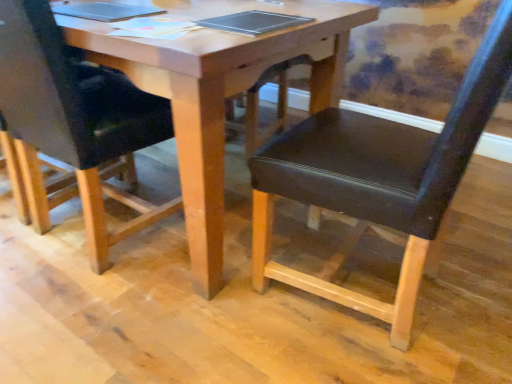
Find the location of `black leather chair at center, marked as the second chair in a left-to-right arrangement`. black leather chair at center, marked as the second chair in a left-to-right arrangement is located at coordinates (378, 180).

The image size is (512, 384). Find the location of `wooden table at center`. wooden table at center is located at coordinates (220, 92).

Describe the element at coordinates (73, 126) in the screenshot. I see `black leather chair at center, acting as the 1th chair starting from the left` at that location.

Find the location of a particular element. black leather chair at center, marked as the second chair in a left-to-right arrangement is located at coordinates (378, 180).

Is point (314, 11) positioned after point (257, 34)?

Yes, point (314, 11) is behind point (257, 34).

Between wooden table at center and metallic silver notebook at center, which one appears on the right side from the viewer's perspective?

Positioned to the right is metallic silver notebook at center.

Does wooden table at center lie in front of metallic silver notebook at center?

Yes, the depth of wooden table at center is less than that of metallic silver notebook at center.

Locate an element on the screen. This screenshot has width=512, height=384. chair that is the 1st object above the wooden table at center (from a real-world perspective) is located at coordinates (73, 126).

Is black leather chair at center, acting as the 1th chair starting from the left, oriented away from wooden table at center?

Yes, wooden table at center is at the back of black leather chair at center, acting as the 1th chair starting from the left.

Is point (104, 261) behind point (251, 51)?

That is True.

Which object is further away from the camera taking this photo, black leather chair at center, which ranks as the 2th chair in right-to-left order, or wooden table at center?

black leather chair at center, which ranks as the 2th chair in right-to-left order, is more distant.

Does metallic silver notebook at center have a smaller size compared to wooden table at center?

Yes, metallic silver notebook at center is smaller than wooden table at center.

From the image's perspective, which object appears higher, metallic silver notebook at center or wooden table at center?

From the image's view, metallic silver notebook at center is above.

Find the location of `table that appears in front of the metallic silver notebook at center`. table that appears in front of the metallic silver notebook at center is located at coordinates (220, 92).

Is metallic silver notebook at center behind wooden table at center?

Yes, the depth of metallic silver notebook at center is greater than that of wooden table at center.

The image size is (512, 384). Identify the location of table that appears above the black leather chair at center, marked as the second chair in a left-to-right arrangement (from the image's perspective). (220, 92).

In the image, is wooden table at center on the left side or the right side of black leather chair at center, marked as the second chair in a left-to-right arrangement?

In the image, wooden table at center appears on the left side of black leather chair at center, marked as the second chair in a left-to-right arrangement.

Does wooden table at center have a smaller size compared to black leather chair at center, acting as the first chair starting from the right?

No.

Do you think wooden table at center is within black leather chair at center, marked as the second chair in a left-to-right arrangement, or outside of it?

wooden table at center is not enclosed by black leather chair at center, marked as the second chair in a left-to-right arrangement.

Can we say black leather chair at center, marked as the second chair in a left-to-right arrangement, lies outside black leather chair at center, acting as the 1th chair starting from the left?

Yes, black leather chair at center, marked as the second chair in a left-to-right arrangement, is located beyond the bounds of black leather chair at center, acting as the 1th chair starting from the left.

How many degrees apart are the facing directions of black leather chair at center, acting as the first chair starting from the right, and black leather chair at center, which ranks as the 2th chair in right-to-left order?

black leather chair at center, acting as the first chair starting from the right, and black leather chair at center, which ranks as the 2th chair in right-to-left order, are facing 93.1 degrees away from each other.

Is black leather chair at center, marked as the second chair in a left-to-right arrangement, positioned far away from black leather chair at center, which ranks as the 2th chair in right-to-left order?

black leather chair at center, marked as the second chair in a left-to-right arrangement, is near black leather chair at center, which ranks as the 2th chair in right-to-left order, not far away.

From the image's perspective, is black leather chair at center, marked as the second chair in a left-to-right arrangement, positioned above or below black leather chair at center, acting as the 1th chair starting from the left?

From the image's perspective, black leather chair at center, marked as the second chair in a left-to-right arrangement, appears below black leather chair at center, acting as the 1th chair starting from the left.

Between metallic silver notebook at center and black leather chair at center, acting as the 1th chair starting from the left, which one has larger size?

black leather chair at center, acting as the 1th chair starting from the left.

Based on the photo, how different are the orientations of metallic silver notebook at center and black leather chair at center, which ranks as the 2th chair in right-to-left order, in degrees?

89 degrees separate the facing orientations of metallic silver notebook at center and black leather chair at center, which ranks as the 2th chair in right-to-left order.

Is metallic silver notebook at center far away from black leather chair at center, which ranks as the 2th chair in right-to-left order?

No, metallic silver notebook at center is in close proximity to black leather chair at center, which ranks as the 2th chair in right-to-left order.

From a real-world perspective, is metallic silver notebook at center physically located above or below black leather chair at center, acting as the 1th chair starting from the left?

In terms of real-world spatial position, metallic silver notebook at center is above black leather chair at center, acting as the 1th chair starting from the left.

Consider the image. From the image's perspective, would you say black leather chair at center, acting as the 1th chair starting from the left, is shown under black leather chair at center, marked as the second chair in a left-to-right arrangement?

No.

Between point (4, 33) and point (451, 199), which one is positioned behind?

Positioned behind is point (4, 33).

Is black leather chair at center, acting as the 1th chair starting from the left, next to black leather chair at center, acting as the first chair starting from the right?

No, black leather chair at center, acting as the 1th chair starting from the left, is not next to black leather chair at center, acting as the first chair starting from the right.

Find the location of a particular element. Image resolution: width=512 pixels, height=384 pixels. table that appears in front of the metallic silver notebook at center is located at coordinates (220, 92).

Where is `table above the black leather chair at center, acting as the 1th chair starting from the left (from the image's perspective)`? table above the black leather chair at center, acting as the 1th chair starting from the left (from the image's perspective) is located at coordinates (220, 92).

From the image, which object appears to be farther from black leather chair at center, acting as the 1th chair starting from the left, wooden table at center or black leather chair at center, marked as the second chair in a left-to-right arrangement?

black leather chair at center, marked as the second chair in a left-to-right arrangement, is further to black leather chair at center, acting as the 1th chair starting from the left.

Based on their spatial positions, is black leather chair at center, acting as the 1th chair starting from the left, or black leather chair at center, acting as the first chair starting from the right, further from metallic silver notebook at center?

black leather chair at center, acting as the 1th chair starting from the left, lies further to metallic silver notebook at center than the other object.

Estimate the real-world distances between objects in this image. Which object is further from black leather chair at center, acting as the 1th chair starting from the left, metallic silver notebook at center or black leather chair at center, marked as the second chair in a left-to-right arrangement?

Based on the image, black leather chair at center, marked as the second chair in a left-to-right arrangement, appears to be further to black leather chair at center, acting as the 1th chair starting from the left.

Estimate the real-world distances between objects in this image. Which object is further from black leather chair at center, marked as the second chair in a left-to-right arrangement, black leather chair at center, which ranks as the 2th chair in right-to-left order, or wooden table at center?

The object further to black leather chair at center, marked as the second chair in a left-to-right arrangement, is black leather chair at center, which ranks as the 2th chair in right-to-left order.

Estimate the real-world distances between objects in this image. Which object is further from black leather chair at center, acting as the first chair starting from the right, wooden table at center or metallic silver notebook at center?

The object further to black leather chair at center, acting as the first chair starting from the right, is metallic silver notebook at center.

Based on their spatial positions, is black leather chair at center, which ranks as the 2th chair in right-to-left order, or black leather chair at center, marked as the second chair in a left-to-right arrangement, further from wooden table at center?

black leather chair at center, which ranks as the 2th chair in right-to-left order, is positioned further to the anchor wooden table at center.

Looking at the image, which one is located closer to wooden table at center, metallic silver notebook at center or black leather chair at center, marked as the second chair in a left-to-right arrangement?

metallic silver notebook at center is positioned closer to the anchor wooden table at center.

Based on their spatial positions, is black leather chair at center, acting as the first chair starting from the right, or metallic silver notebook at center further from wooden table at center?

The object further to wooden table at center is black leather chair at center, acting as the first chair starting from the right.

Where is `notebook between black leather chair at center, which ranks as the 2th chair in right-to-left order, and black leather chair at center, acting as the first chair starting from the right`? The image size is (512, 384). notebook between black leather chair at center, which ranks as the 2th chair in right-to-left order, and black leather chair at center, acting as the first chair starting from the right is located at coordinates (253, 22).

This screenshot has height=384, width=512. Identify the location of table between black leather chair at center, acting as the 1th chair starting from the left, and metallic silver notebook at center from left to right. (220, 92).

The image size is (512, 384). In order to click on table located between black leather chair at center, which ranks as the 2th chair in right-to-left order, and black leather chair at center, acting as the first chair starting from the right, in the left-right direction in this screenshot , I will do `click(220, 92)`.

Identify the location of notebook located between wooden table at center and black leather chair at center, acting as the first chair starting from the right, in the left-right direction. This screenshot has width=512, height=384. (253, 22).